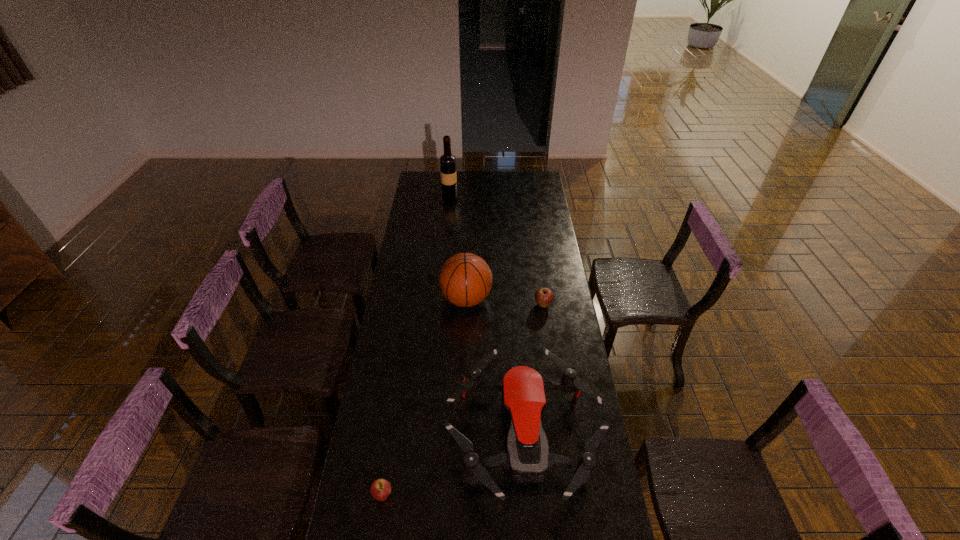
Where is `the tallest object`? the tallest object is located at coordinates click(447, 161).

Find the location of a particular element. The width and height of the screenshot is (960, 540). the farthest object is located at coordinates (447, 161).

You are a GUI agent. You are given a task and a screenshot of the screen. Output one action in this format:
    pyautogui.click(x=<x>, y=<y>)
    Task: Click on the basketball
    The height and width of the screenshot is (540, 960).
    Given the screenshot: What is the action you would take?
    pyautogui.click(x=465, y=279)

Locate an element on the screen. Image resolution: width=960 pixels, height=540 pixels. drone is located at coordinates (527, 458).

What are the coordinates of `the right apple` in the screenshot? It's located at (544, 296).

The width and height of the screenshot is (960, 540). Identify the location of the leftmost object. (380, 489).

In order to click on the left apple in this screenshot , I will do `click(380, 489)`.

The image size is (960, 540). I want to click on free space located on the right of the wine bottle, so click(x=498, y=195).

Find the location of a particular element. This screenshot has height=540, width=960. vacant space located 0.250m on the back of the basketball is located at coordinates pos(468,248).

You are a GUI agent. You are given a task and a screenshot of the screen. Output one action in this format:
    pyautogui.click(x=<x>, y=<y>)
    Task: Click on the vacant area situated on the left of the right apple
    This screenshot has width=960, height=540.
    Given the screenshot: What is the action you would take?
    pyautogui.click(x=516, y=305)